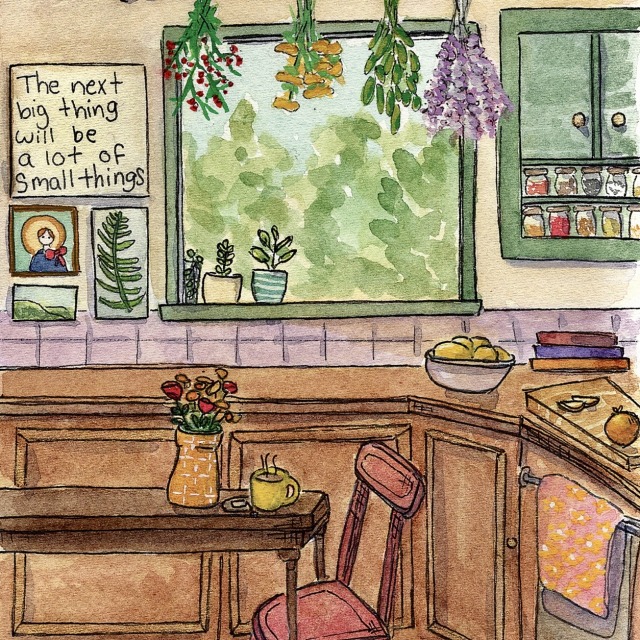
At what (x,y) coordinates should I click in order to perform the action: click on chair. Please return your answer as a coordinate pair (x, y). Looking at the image, I should click on (348, 612).